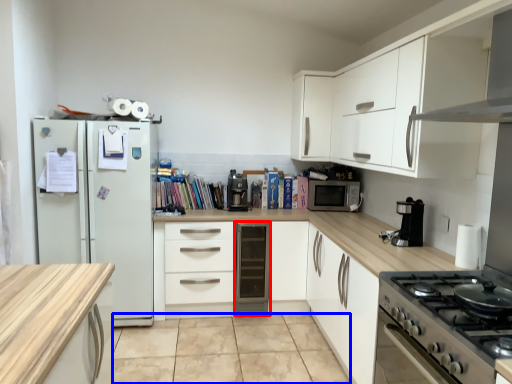
Question: Among these objects, which one is farthest to the camera, file cabinet (highlighted by a red box) or tile (highlighted by a blue box)?

Choices:
 (A) file cabinet
 (B) tile

Answer: (A)